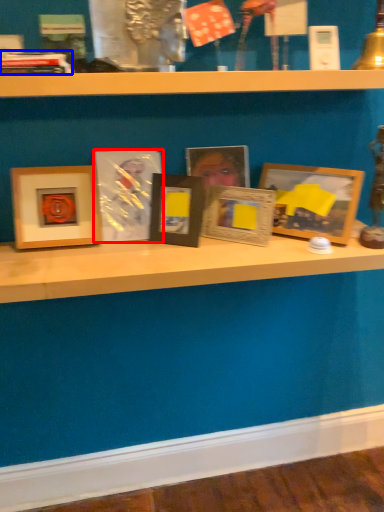
Question: Which object is further to the camera taking this photo, picture frame (highlighted by a red box) or book (highlighted by a blue box)?

Choices:
 (A) picture frame
 (B) book

Answer: (A)